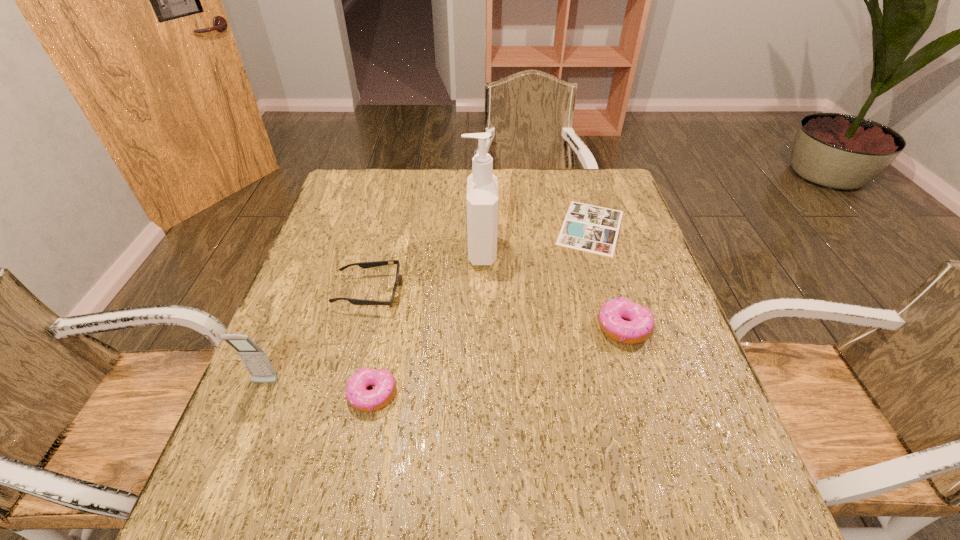
Identify the location of sunglasses located at the left edge. (364, 265).

Identify the location of doughnut at the right edge. Image resolution: width=960 pixels, height=540 pixels. (640, 325).

Identify the location of book positioned at the right edge. This screenshot has width=960, height=540. (588, 228).

This screenshot has height=540, width=960. I want to click on object positioned at the far right corner, so click(588, 228).

The height and width of the screenshot is (540, 960). I want to click on vacant space at the far edge of the desktop, so click(x=534, y=181).

This screenshot has width=960, height=540. In the image, there is a desktop. In order to click on vacant space at the left edge in this screenshot , I will do `click(357, 254)`.

At what (x,y) coordinates should I click in order to perform the action: click on free spot at the right edge of the desktop. Please return your answer as a coordinate pair (x, y). The width and height of the screenshot is (960, 540). Looking at the image, I should click on (694, 407).

Locate an element on the screen. vacant space at the far left corner of the desktop is located at coordinates coord(379,174).

Find the location of a particular element. This screenshot has height=540, width=960. vacant space at the near left corner of the desktop is located at coordinates (242, 427).

Image resolution: width=960 pixels, height=540 pixels. What are the coordinates of `free space at the far right corner of the desktop` in the screenshot? It's located at (628, 198).